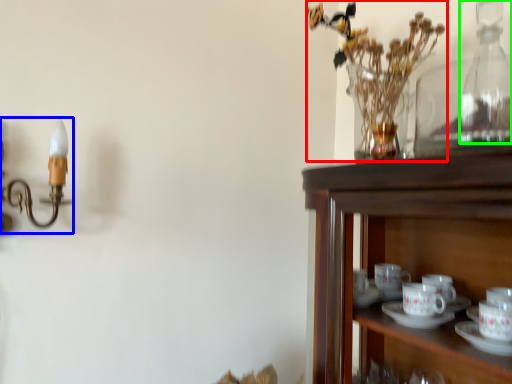
Question: Based on their relative distances, which object is nearer to floral arrangement (highlighted by a red box)? Choose from candle holder (highlighted by a blue box) and bottle (highlighted by a green box).

Choices:
 (A) candle holder
 (B) bottle

Answer: (B)